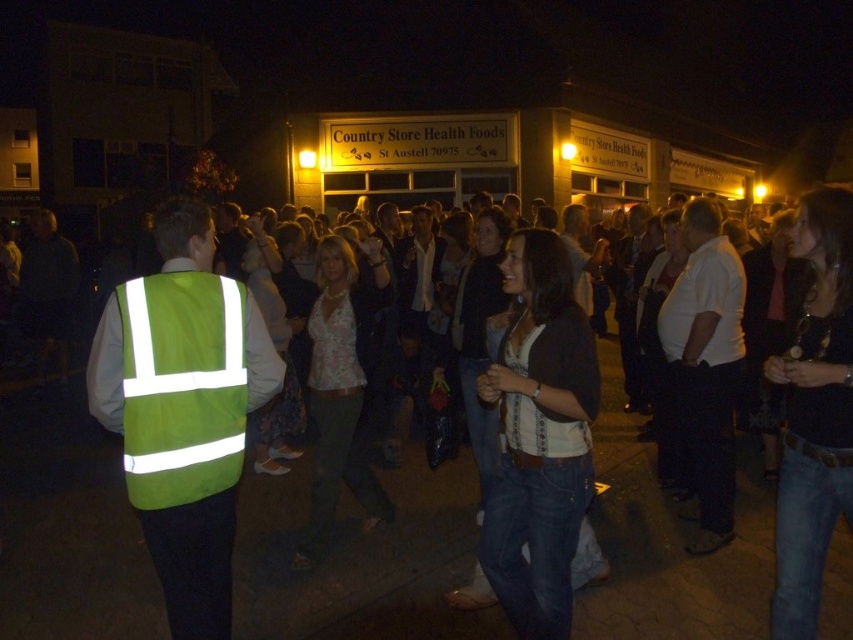
Question: Which of the following is the farthest from the observer?

Choices:
 (A) reflective fabric vest at left
 (B) jeans at center

Answer: (B)

Question: Does jeans at center appear on the right side of green reflective safety vest at left?

Choices:
 (A) yes
 (B) no

Answer: (B)

Question: Observing the image, what is the correct spatial positioning of reflective fabric vest at left in reference to green reflective safety vest at left?

Choices:
 (A) right
 (B) left

Answer: (B)

Question: Which of the following is the closest to the observer?

Choices:
 (A) jeans at center
 (B) reflective fabric vest at left

Answer: (B)

Question: Which object is farther from the camera taking this photo?

Choices:
 (A) reflective fabric vest at left
 (B) green reflective safety vest at left

Answer: (A)

Question: Does reflective fabric vest at left appear on the left side of green reflective safety vest at left?

Choices:
 (A) no
 (B) yes

Answer: (B)